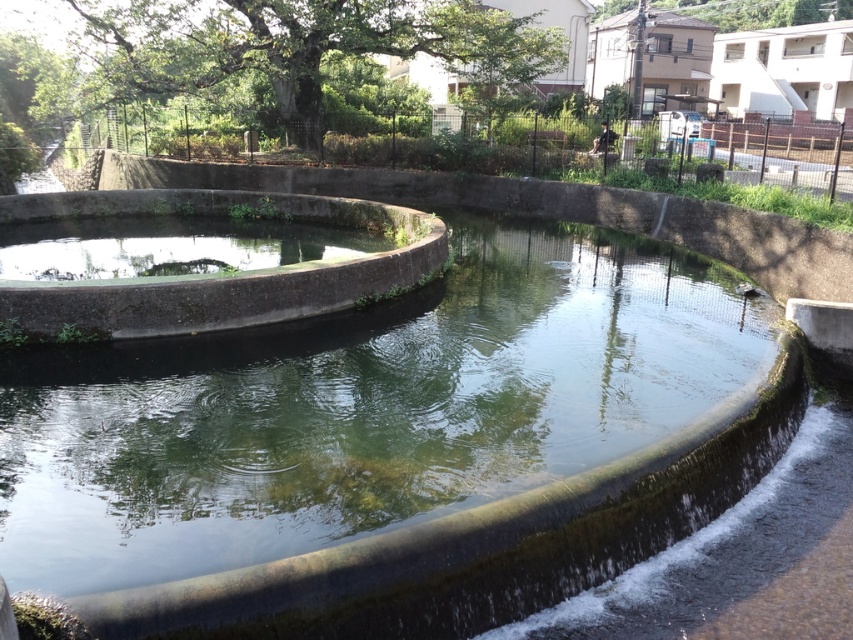
At what (x,y) coordinates should I click in order to perform the action: click on smooth concrete fountain at center. Please return your answer as a coordinate pair (x, y). This screenshot has width=853, height=640. Looking at the image, I should click on (480, 544).

Who is lower down, smooth concrete fountain at center or smooth concrete basin at center?

smooth concrete fountain at center

Find the location of a particular element. smooth concrete fountain at center is located at coordinates (480, 544).